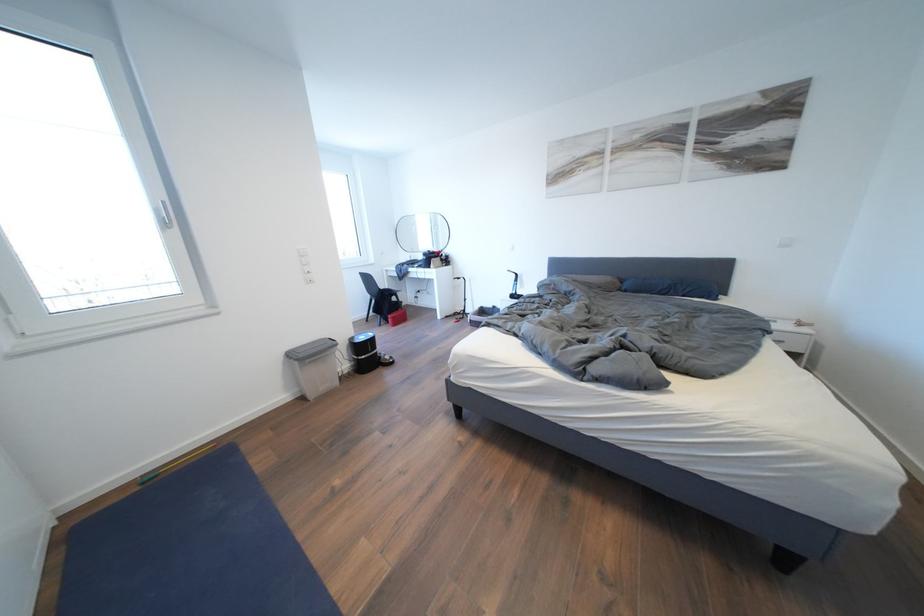
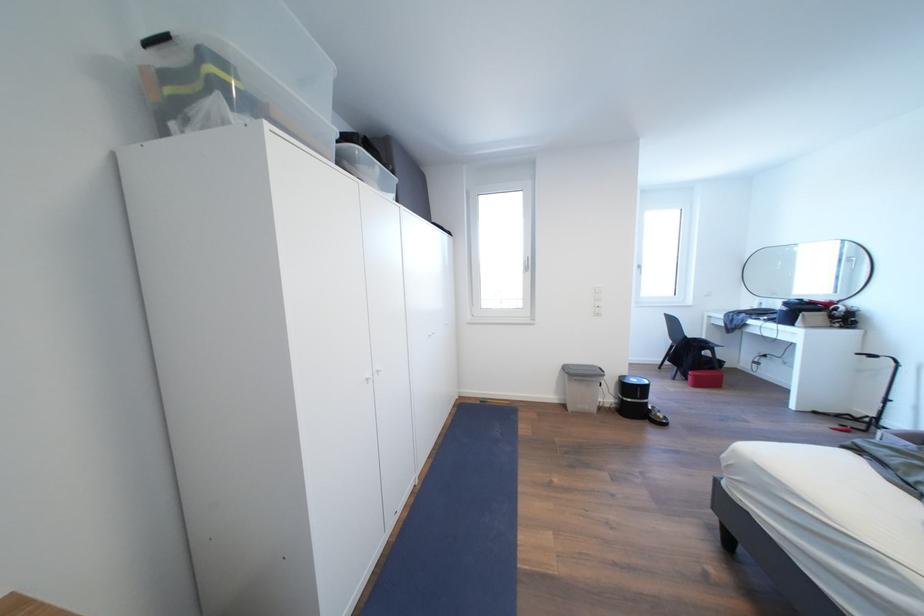
The point at (370, 342) is marked in the first image. Where is the corresponding point in the second image?

(641, 386)